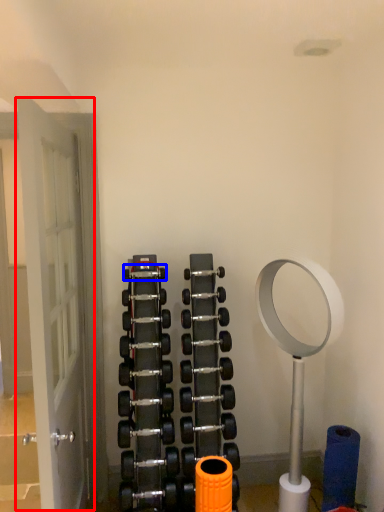
Question: Which of the following is the closest to the observer, door (highlighted by a red box) or dumbbell (highlighted by a blue box)?

Choices:
 (A) door
 (B) dumbbell

Answer: (A)